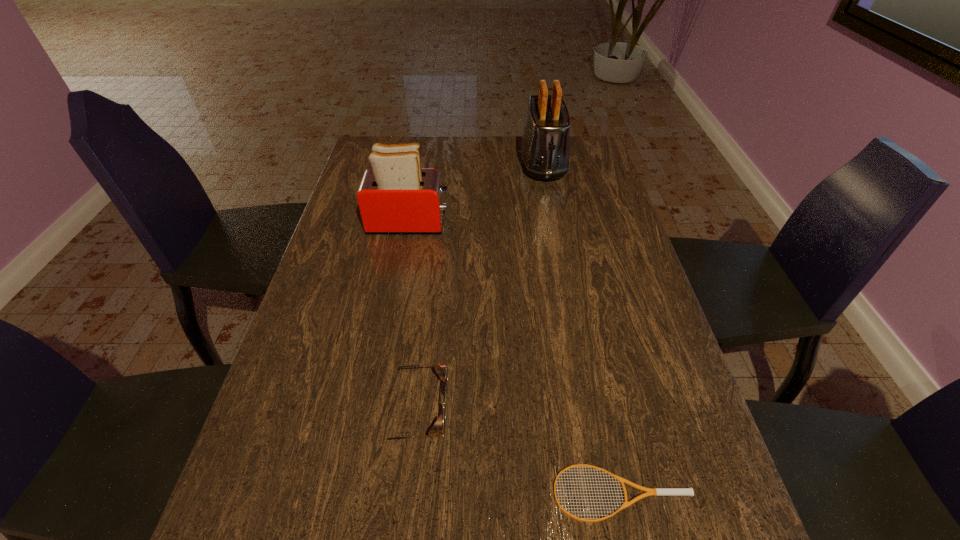
Identify the location of vacant space at the far right corner of the desktop. (577, 141).

Identify the location of free spot between the farther toaster and the nearest object. (583, 328).

Find the location of `free spot between the right toaster and the third nearest object`. free spot between the right toaster and the third nearest object is located at coordinates tap(476, 193).

Identify the location of free point between the second nearest object and the shortest object. This screenshot has width=960, height=540. (517, 452).

Where is `free space that is in between the nearer toaster and the shortest object`? This screenshot has width=960, height=540. free space that is in between the nearer toaster and the shortest object is located at coordinates pos(516,358).

Where is `empty space between the second farthest object and the third farthest object`? This screenshot has width=960, height=540. empty space between the second farthest object and the third farthest object is located at coordinates pos(411,317).

At what (x,y) coordinates should I click in order to perform the action: click on vacant area that lies between the right toaster and the second nearest object. Please return your answer as a coordinate pair (x, y). Looking at the image, I should click on (478, 287).

Locate an element on the screen. Image resolution: width=960 pixels, height=540 pixels. free spot between the nearer toaster and the farthest object is located at coordinates (476, 193).

Locate an element on the screen. vacant space that is in between the nearer toaster and the shortest object is located at coordinates (516, 358).

At what (x,y) coordinates should I click in order to perform the action: click on vacant point located between the sunglasses and the tennis racket. Please return your answer as a coordinate pair (x, y). Image resolution: width=960 pixels, height=540 pixels. Looking at the image, I should click on (517, 452).